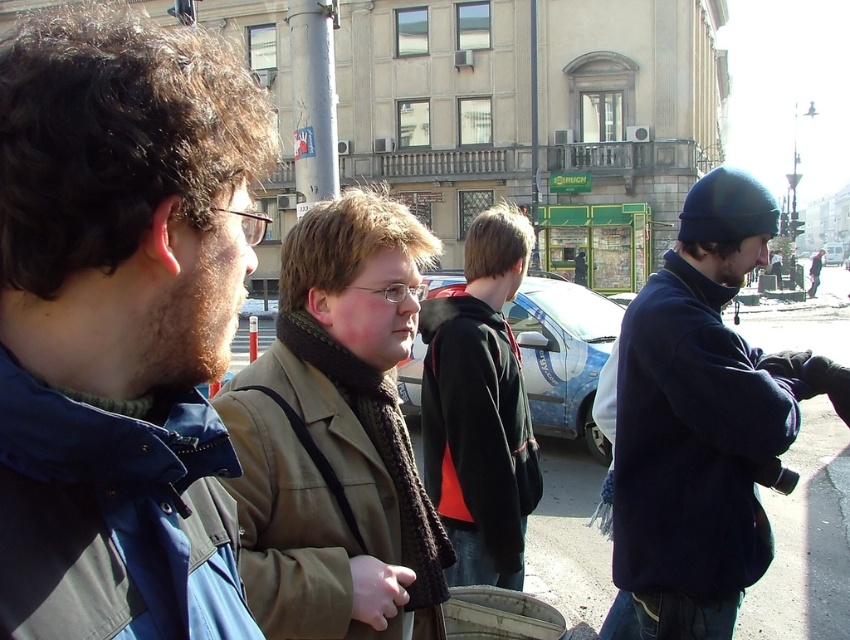
You are a photographer trying to capture a clear shot of the khaki fabric jacket at center without the blue fabric jacket at left blocking it. What should you do?

The blue fabric jacket at left is in front of the khaki fabric jacket at center, so you should move to the right side to position yourself where the blue jacket is no longer blocking the view of the khaki jacket.

You are trying to decide which jacket to wear for a cold day. You see the blue fabric jacket at left and the dark blue fleece jacket at right in the image. Which one would provide better insulation based on their appearance?

The dark blue fleece jacket at right is thicker than the blue fabric jacket at left, so it would provide better insulation.

You are a delivery robot with a 1.2 meter long package that needs to be placed between the blue fabric jacket at left and the viewer. Is there enough space to fit the package there?

The distance between the blue fabric jacket at left and the viewer is 1.16 meters, so the 1.2 meter long package cannot fit in that space since it is slightly longer than the available distance.